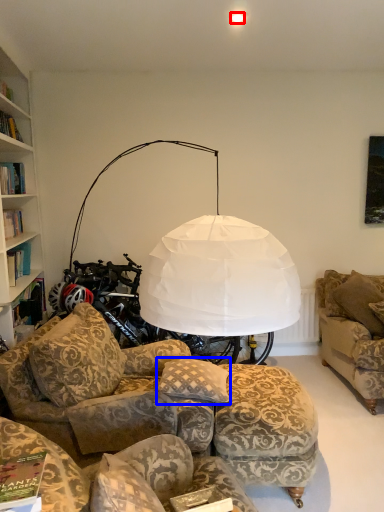
Question: Which object appears closest to the camera in this image, lighting (highlighted by a red box) or pillow (highlighted by a blue box)?

Choices:
 (A) lighting
 (B) pillow

Answer: (B)